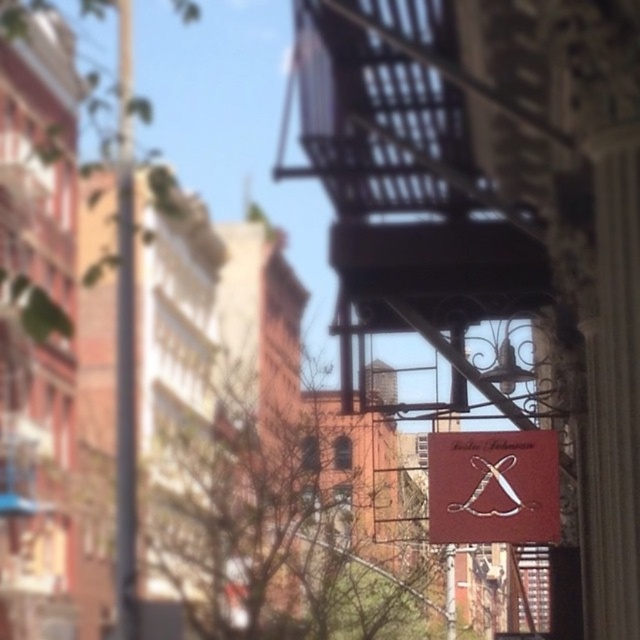
Is maroon leather sign at center behind metallic pole at left?

No, maroon leather sign at center is in front of metallic pole at left.

Is maroon leather sign at center bigger than metallic pole at left?

No, maroon leather sign at center is not bigger than metallic pole at left.

Which is behind, point (468, 516) or point (122, 328)?

The point (122, 328) is more distant.

Identify the location of maroon leather sign at center. (493, 486).